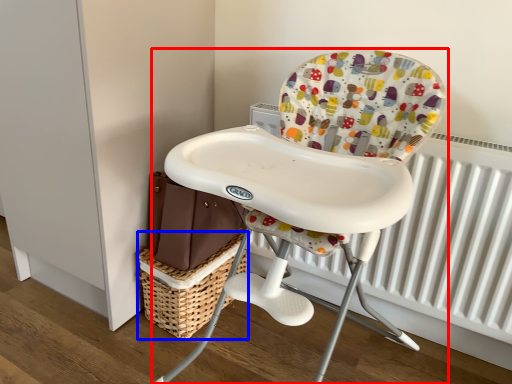
Question: Which object is further to the camera taking this photo, chair (highlighted by a red box) or basket (highlighted by a blue box)?

Choices:
 (A) chair
 (B) basket

Answer: (B)